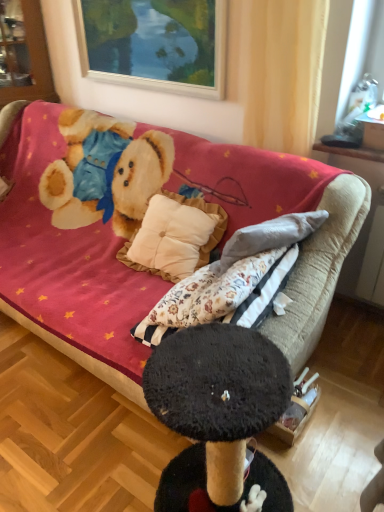
Question: From a real-world perspective, is brushed metal cabinet at upper left physically below yellow sheer curtain at upper center?

Choices:
 (A) yes
 (B) no

Answer: (A)

Question: Is brushed metal cabinet at upper left not within yellow sheer curtain at upper center?

Choices:
 (A) no
 (B) yes

Answer: (B)

Question: Does brushed metal cabinet at upper left have a lesser width compared to yellow sheer curtain at upper center?

Choices:
 (A) yes
 (B) no

Answer: (B)

Question: From the image's perspective, does brushed metal cabinet at upper left appear higher than yellow sheer curtain at upper center?

Choices:
 (A) yes
 (B) no

Answer: (A)

Question: Could you tell me if brushed metal cabinet at upper left is facing yellow sheer curtain at upper center?

Choices:
 (A) yes
 (B) no

Answer: (B)

Question: Considering their positions, is velvet beige couch at center located in front of or behind brushed metal cabinet at upper left?

Choices:
 (A) behind
 (B) front

Answer: (B)

Question: From their relative heights in the image, would you say velvet beige couch at center is taller or shorter than brushed metal cabinet at upper left?

Choices:
 (A) tall
 (B) short

Answer: (A)

Question: Would you say velvet beige couch at center is inside or outside brushed metal cabinet at upper left?

Choices:
 (A) outside
 (B) inside

Answer: (A)

Question: Looking at their shapes, would you say velvet beige couch at center is wider or thinner than brushed metal cabinet at upper left?

Choices:
 (A) wide
 (B) thin

Answer: (A)

Question: Is brushed metal cabinet at upper left wider or thinner than yellow sheer curtain at upper center?

Choices:
 (A) wide
 (B) thin

Answer: (A)

Question: Is brushed metal cabinet at upper left in front of or behind yellow sheer curtain at upper center in the image?

Choices:
 (A) front
 (B) behind

Answer: (B)

Question: In terms of size, does brushed metal cabinet at upper left appear bigger or smaller than yellow sheer curtain at upper center?

Choices:
 (A) big
 (B) small

Answer: (A)

Question: Would you say brushed metal cabinet at upper left is to the left or to the right of yellow sheer curtain at upper center in the picture?

Choices:
 (A) right
 (B) left

Answer: (B)

Question: From a real-world perspective, is wooden picture frame at upper center positioned above or below velvet beige couch at center?

Choices:
 (A) above
 (B) below

Answer: (A)

Question: Is wooden picture frame at upper center inside the boundaries of velvet beige couch at center, or outside?

Choices:
 (A) inside
 (B) outside

Answer: (B)